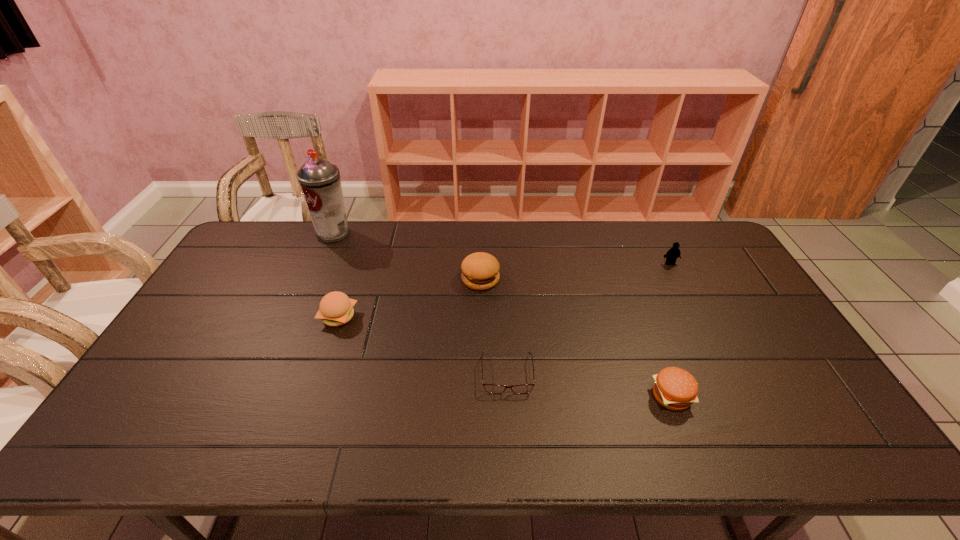
This screenshot has height=540, width=960. In the image, there is a desktop. In order to click on vacant space at the right edge in this screenshot , I will do `click(694, 262)`.

In the image, there is a desktop. Where is `vacant space at the far left corner`? This screenshot has width=960, height=540. vacant space at the far left corner is located at coordinates (241, 259).

Find the location of `vacant region between the leftmost hamburger and the spectacles`. vacant region between the leftmost hamburger and the spectacles is located at coordinates (422, 345).

Identify the location of vacant area that lies between the fifth tallest object and the second hamburger from right to left. This screenshot has width=960, height=540. (576, 338).

The width and height of the screenshot is (960, 540). I want to click on vacant region between the farthest object and the fifth tallest object, so coord(502,315).

The width and height of the screenshot is (960, 540). Find the location of `vacant area between the fifth nearest object and the spectacles`. vacant area between the fifth nearest object and the spectacles is located at coordinates (588, 319).

Where is `free space between the spectacles and the second farthest object`? Image resolution: width=960 pixels, height=540 pixels. free space between the spectacles and the second farthest object is located at coordinates (588, 319).

Locate an element on the screen. This screenshot has width=960, height=540. vacant area between the aerosol can and the second hamburger from right to left is located at coordinates (407, 256).

This screenshot has width=960, height=540. Identify the location of vacant area between the leftmost hamburger and the farthest hamburger. (410, 298).

In order to click on free space between the shortest object and the second hamburger from left to right in this screenshot , I will do `click(493, 326)`.